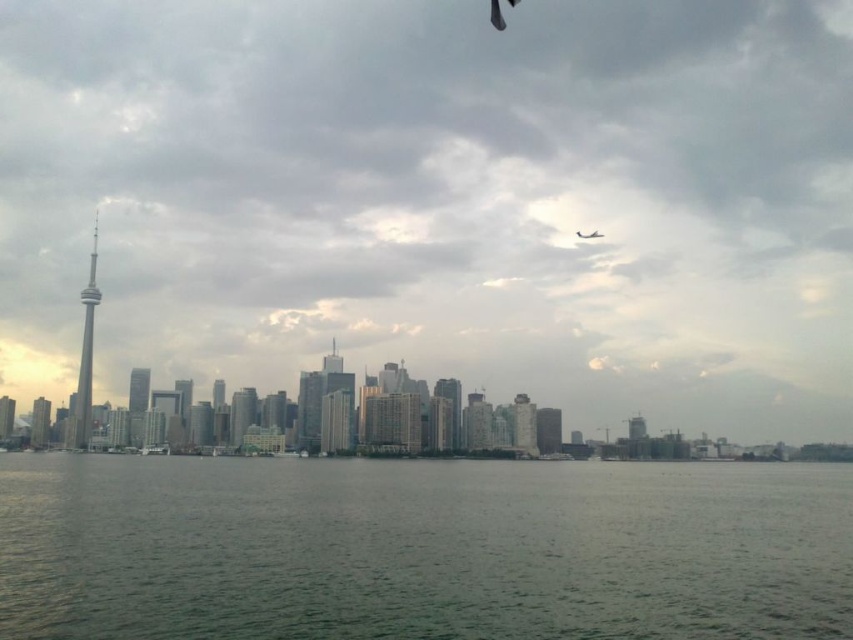
Who is more forward, (141, 552) or (602, 236)?

Point (141, 552) is in front.

Between gray-green water at center and white matte airplane at upper center, which one is positioned higher?

white matte airplane at upper center

Locate an element on the screen. gray-green water at center is located at coordinates (421, 548).